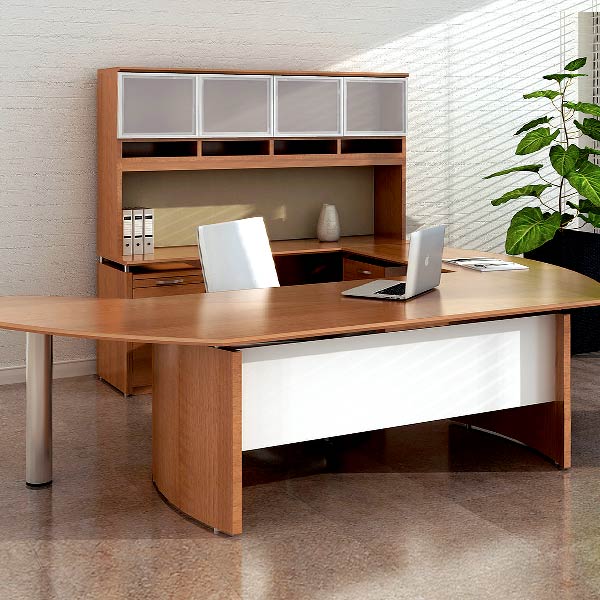
Image resolution: width=600 pixels, height=600 pixels. I want to click on brown floor, so click(417, 550).